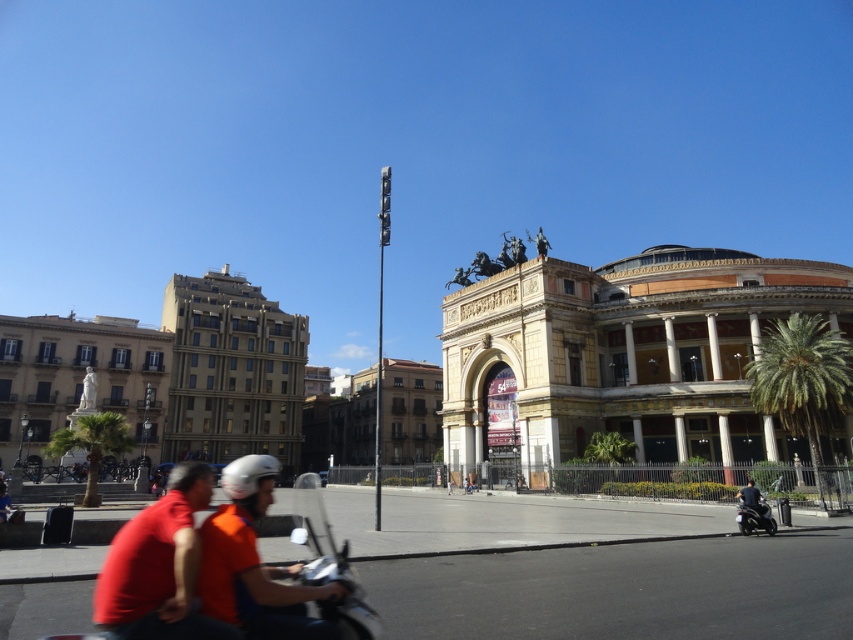
You are standing in the urban scene and want to move from the green leafy palm tree at lower left to the dark gray fabric jacket at lower right. Which direction should you move to reach the jacket?

To move from the green leafy palm tree at lower left to the dark gray fabric jacket at lower right, you should move to the right since the jacket is positioned to the right of the palm tree.

You are standing at the center of the image and want to take a photo of the green leafy palm tree at lower left without the historical building in the background. Is the palm tree positioned in a way that allows this?

The green leafy palm tree at lower left is located at point (91, 444), which is near the edge of the image. Since the historical building is in the background, you can position yourself so that the palm tree is framed away from the building, ensuring it doesn not appear in the photo.

You are a photographer standing in the middle of the scene. You want to take a photo that includes both the scooter riders and the historical building. Which point, point (817, 355) or point (96, 440), should you focus on first to ensure both subjects are in focus?

You should focus on point (817, 355) first because it is closer to the camera than point (96, 440). This will help ensure the scooter riders in the foreground are in focus while the building in the background remains sharp.